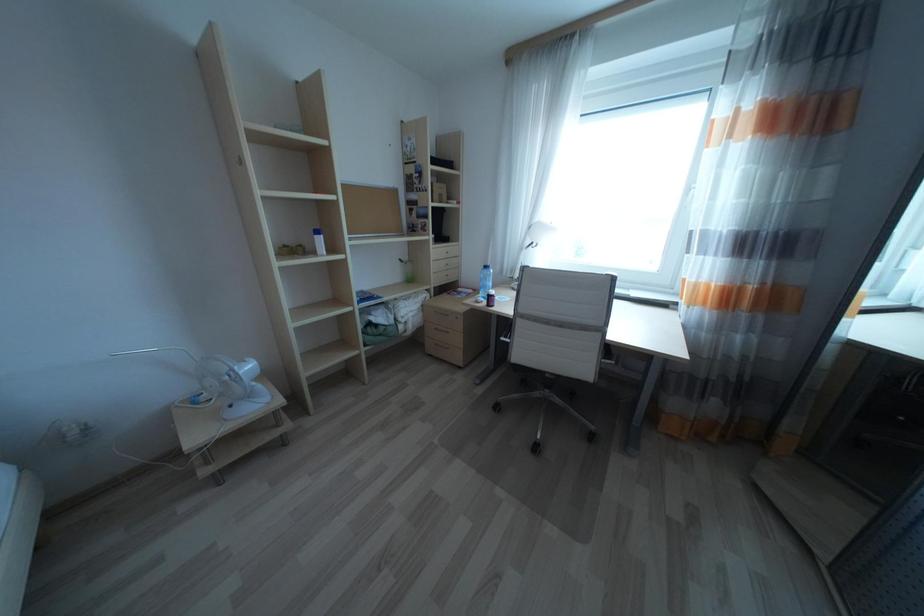
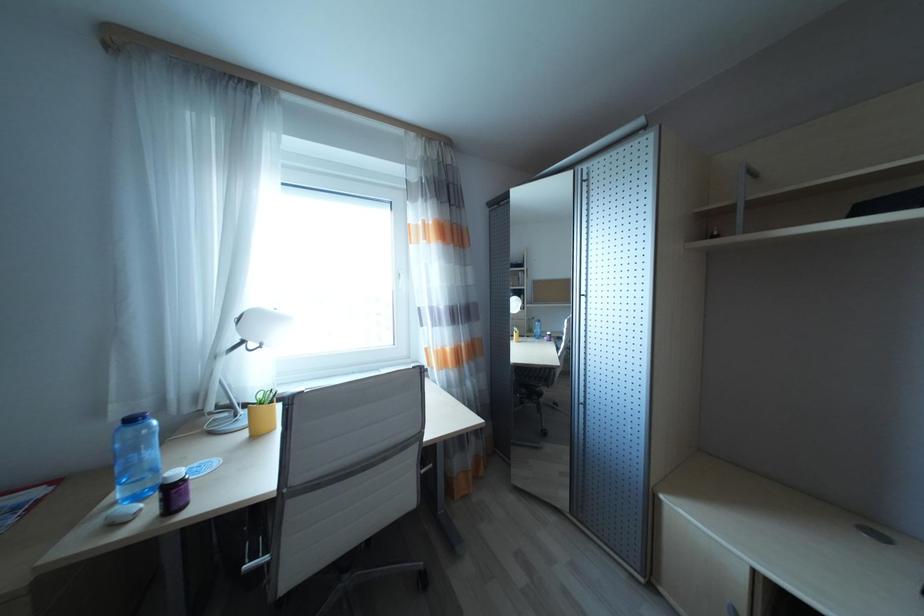
Question: The first image is from the beginning of the video and the second image is from the end. How did the camera likely rotate when shooting the video?

Choices:
 (A) Left
 (B) Right
 (C) Up
 (D) Down

Answer: (B)